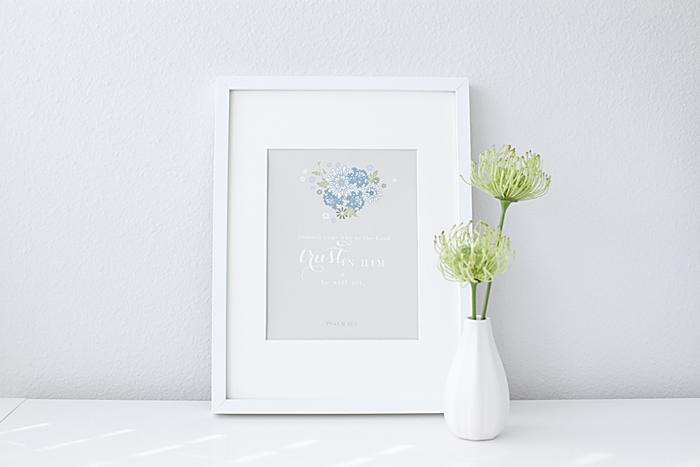
Find the location of a particular element. white picture border is located at coordinates (265, 359).